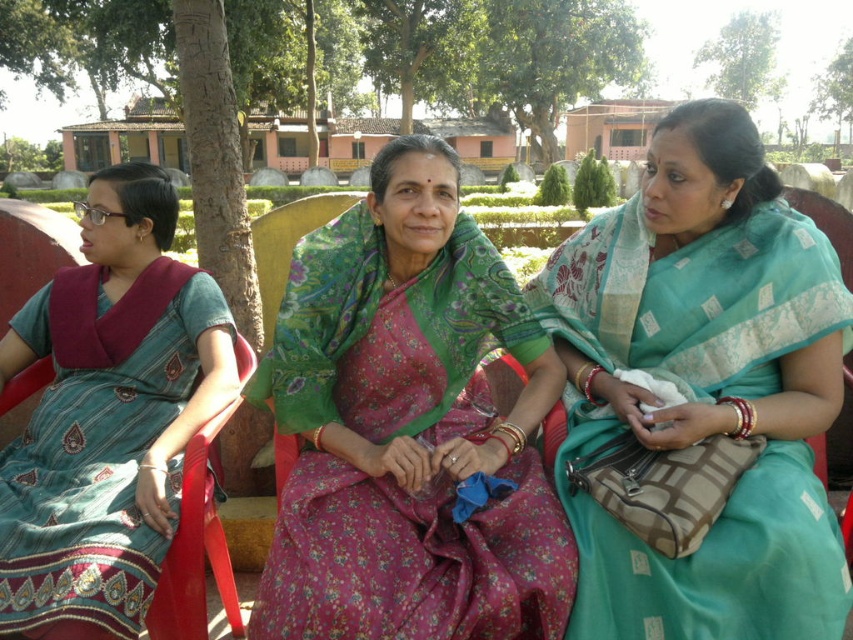
Question: Which is farther from the teal silk saree at center?

Choices:
 (A) green floral saree at center
 (B) teal silk saree at left

Answer: (B)

Question: Is green floral saree at center positioned at the back of teal silk saree at left?

Choices:
 (A) no
 (B) yes

Answer: (B)

Question: In this image, where is green floral saree at center located relative to teal silk saree at left?

Choices:
 (A) below
 (B) above

Answer: (B)

Question: Can you confirm if green floral saree at center is positioned above teal silk saree at left?

Choices:
 (A) yes
 (B) no

Answer: (A)

Question: Which object is the farthest from the green floral saree at center?

Choices:
 (A) teal silk saree at left
 (B) teal silk saree at center

Answer: (A)

Question: Which object is positioned farthest from the teal silk saree at left?

Choices:
 (A) teal silk saree at center
 (B) green floral saree at center

Answer: (A)